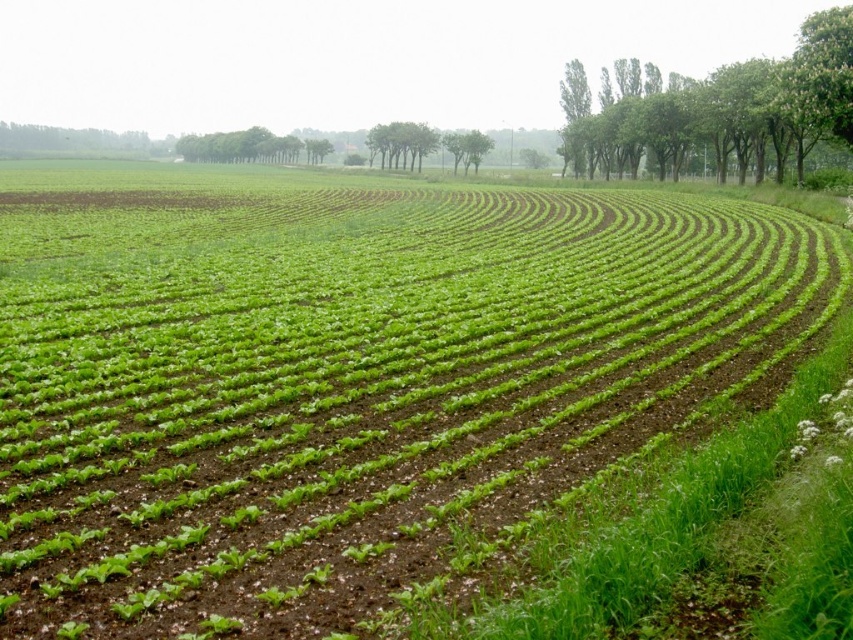
Does green leafy trees at upper right have a lesser height compared to green leafy trees at upper center?

In fact, green leafy trees at upper right may be taller than green leafy trees at upper center.

Who is positioned more to the left, green leafy trees at upper right or green leafy trees at upper center?

green leafy trees at upper center

Is point (773, 124) farther from camera compared to point (213, 157)?

No.

At what (x,y) coordinates should I click in order to perform the action: click on green leafy trees at upper right. Please return your answer as a coordinate pair (x, y). This screenshot has width=853, height=640. Looking at the image, I should click on (718, 108).

Is green leafy trees at center taller than green leafy plant at center?

Correct, green leafy trees at center is much taller as green leafy plant at center.

Which is more to the left, green leafy trees at center or green leafy plant at center?

From the viewer's perspective, green leafy plant at center appears more on the left side.

Measure the distance between point (421, 157) and camera.

245.04 meters

Where is `green leafy trees at center`? Image resolution: width=853 pixels, height=640 pixels. green leafy trees at center is located at coordinates (401, 144).

Does green leafy trees at upper center have a lesser width compared to green leafy plant at center?

No, green leafy trees at upper center is not thinner than green leafy plant at center.

Between green leafy trees at upper center and green leafy plant at center, which one has less height?

Standing shorter between the two is green leafy plant at center.

Which is behind, point (228, 148) or point (322, 160)?

The point (228, 148) is more distant.

The image size is (853, 640). I want to click on green leafy trees at upper center, so click(248, 147).